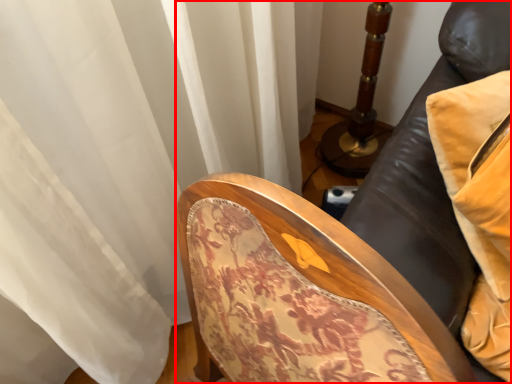
Question: In this image, where is furniture (annotated by the red box) located relative to pillow?

Choices:
 (A) left
 (B) right

Answer: (A)